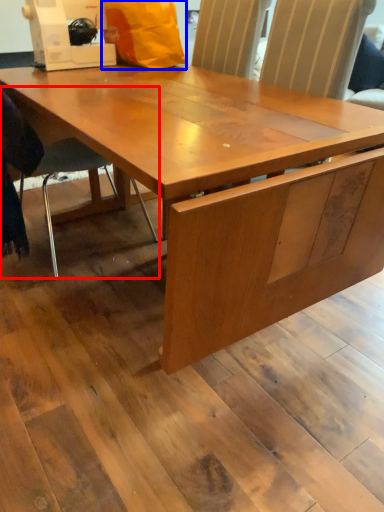
Question: Among these objects, which one is nearest to the camera, chair (highlighted by a red box) or paper bag (highlighted by a blue box)?

Choices:
 (A) chair
 (B) paper bag

Answer: (A)